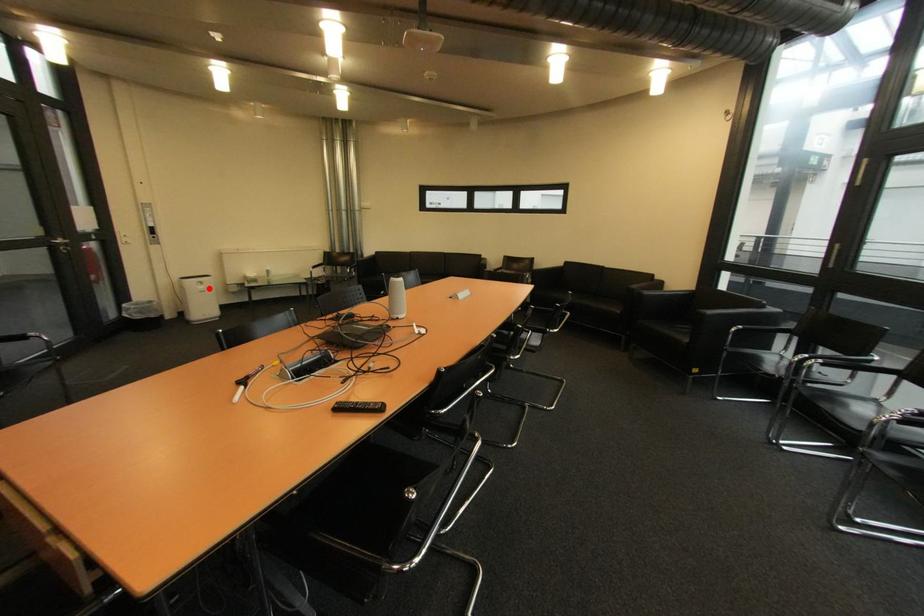
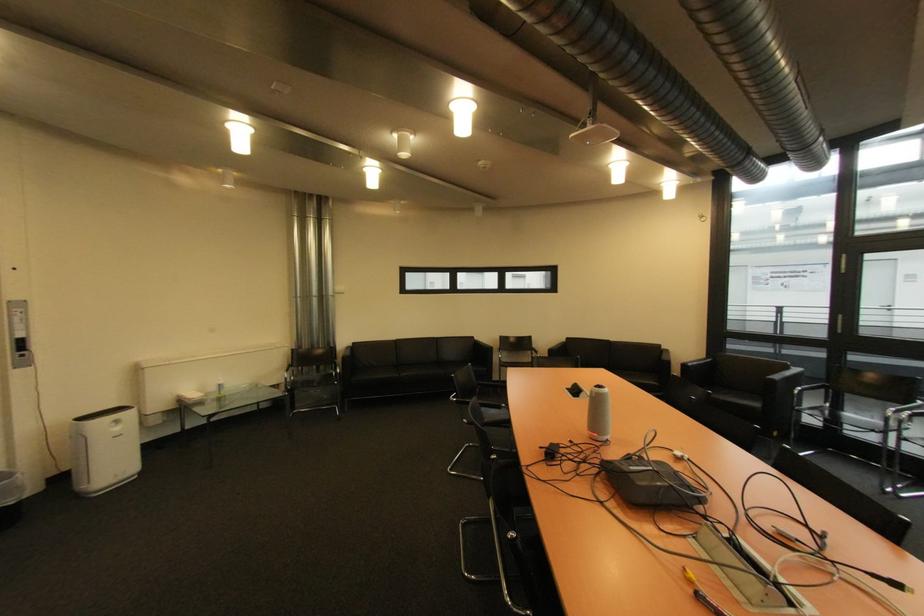
Find the pixel in the second image that matches the highlighted location in the first image.

(124, 430)